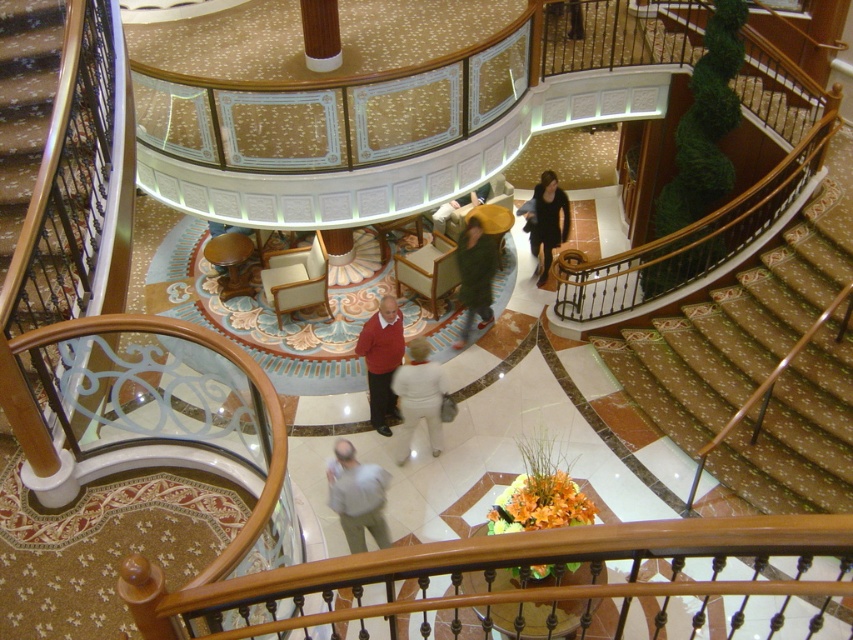
Is wooden at center bigger than black fabric dress at center?

No, wooden at center is not bigger than black fabric dress at center.

Between point (300, 573) and point (548, 193), which one is positioned in front?

Point (300, 573) is in front.

Find the location of `wooden at center`. wooden at center is located at coordinates (535, 586).

Who is shorter, wooden stairwell at left or matte red sweater at center?

matte red sweater at center

Does point (3, 292) lie in front of point (381, 358)?

Yes, it is in front of point (381, 358).

Image resolution: width=853 pixels, height=640 pixels. I want to click on wooden stairwell at left, so click(x=67, y=180).

Does light gray fabric shirt at center have a lesser height compared to matte red sweater at center?

Yes, light gray fabric shirt at center is shorter than matte red sweater at center.

Is point (346, 456) farther from viewer compared to point (380, 333)?

No, (346, 456) is closer to viewer.

At what (x,y) coordinates should I click in order to perform the action: click on light gray fabric shirt at center. Please return your answer as a coordinate pair (x, y). This screenshot has width=853, height=640. Looking at the image, I should click on 357,497.